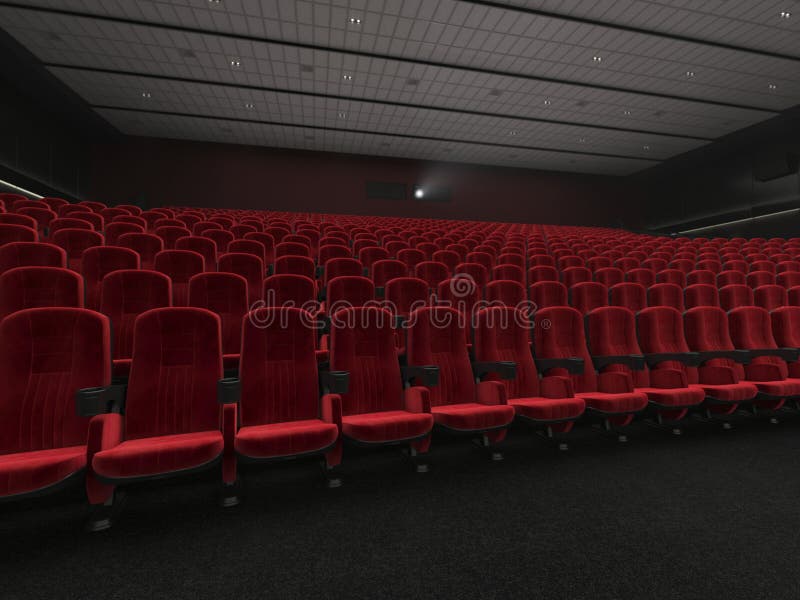
Where is `cupholders`? This screenshot has height=600, width=800. cupholders is located at coordinates (93, 397), (230, 387), (338, 381), (434, 377), (504, 371), (576, 367), (640, 364), (694, 361), (736, 357), (788, 357).